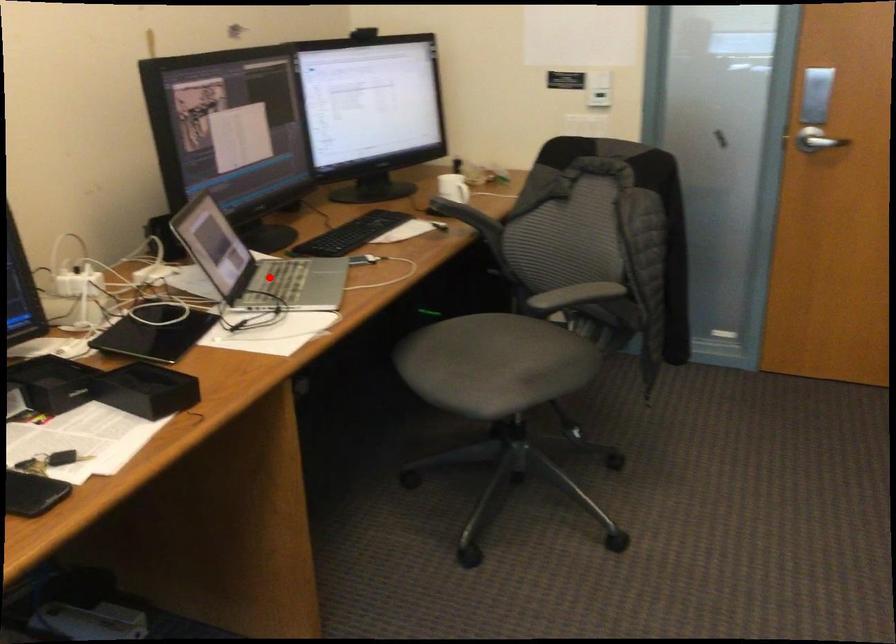
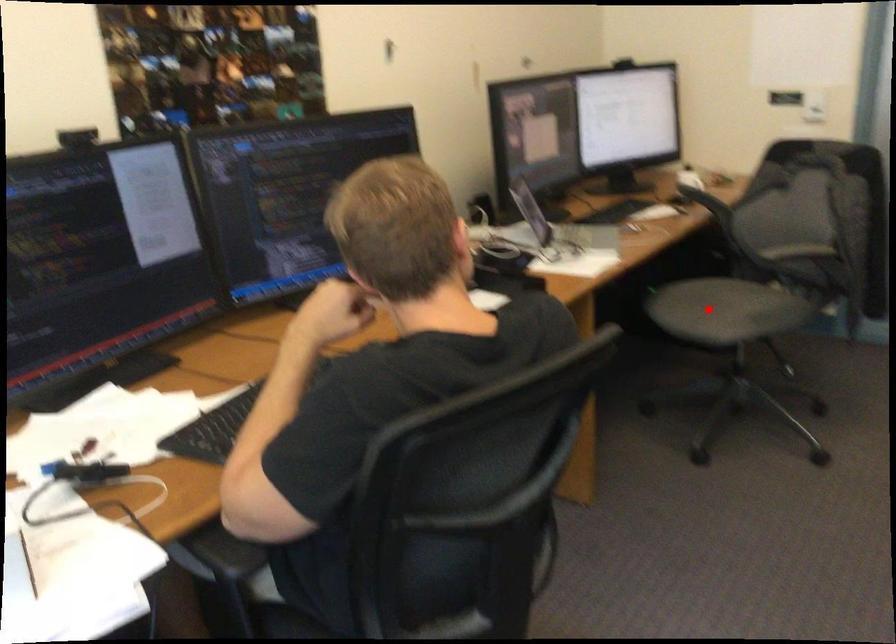
I am providing you with two images of the same scene from different viewpoints. A red point is marked on the first image and another point is marked on the second image. Does the point marked in image1 correspond to the same location as the one in image2?

No